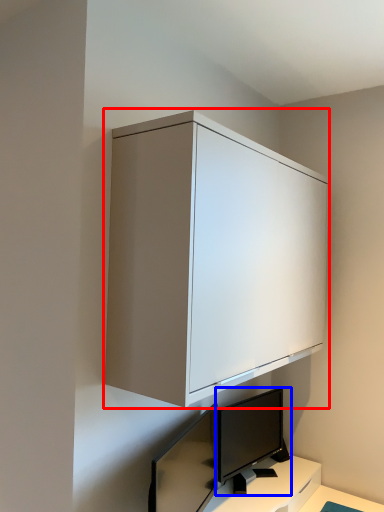
Question: Which point is further to the camera, cabinetry (highlighted by a red box) or computer monitor (highlighted by a blue box)?

Choices:
 (A) cabinetry
 (B) computer monitor

Answer: (B)